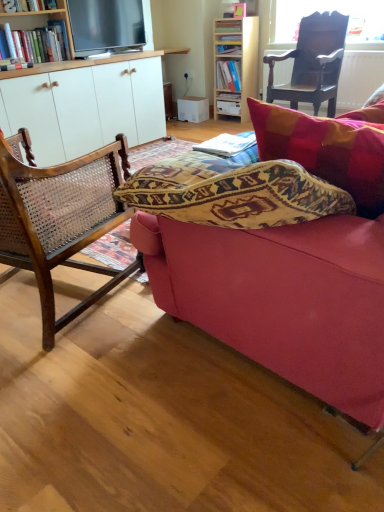
Question: From a real-world perspective, is hardcover book at upper center, which ranks as the 4th book in bottom-to-top order, above or below matte blue book at upper center, which is the 3th book from front to back?

Choices:
 (A) below
 (B) above

Answer: (B)

Question: Is hardcover book at upper center, placed as the 1th book when sorted from top to bottom, taller or shorter than matte blue book at upper center, positioned as the 2th book in top-to-bottom order?

Choices:
 (A) tall
 (B) short

Answer: (B)

Question: Estimate the real-world distances between objects in this image. Which object is farther from the hardcover book at center, the 4th book when ordered from front to back?

Choices:
 (A) matte black television at upper left
 (B) wooden cane chair at left, positioned as the second chair in right-to-left order
 (C) light wood bookcase at upper center
 (D) dark wood chair at upper right, the second chair when ordered from bottom to top
 (E) hardcover book at upper center, which ranks as the 4th book in bottom-to-top order

Answer: (B)

Question: Which object is the farthest from the matte blue book at upper center, arranged as the third book when ordered from the bottom?

Choices:
 (A) matte black television at upper left
 (B) dark wood chair at upper right, placed as the first chair when sorted from back to front
 (C) hardcover book at center, which is the 3th book from top to bottom
 (D) white paper at center, the 1th book positioned from the bottom
 (E) wooden cane chair at left, which is counted as the first chair, starting from the left

Answer: (E)